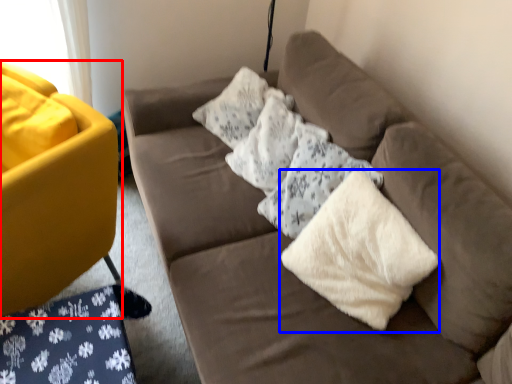
Question: Which object is closer to the camera taking this photo, studio couch (highlighted by a red box) or material (highlighted by a blue box)?

Choices:
 (A) studio couch
 (B) material

Answer: (B)